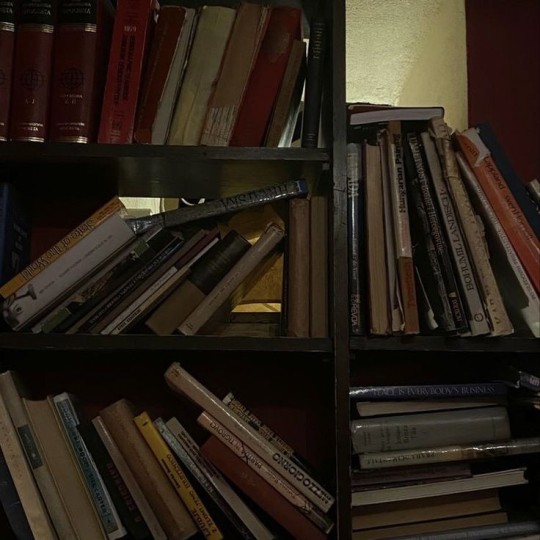
Where is `spaces between books`? This screenshot has height=540, width=540. spaces between books is located at coordinates (291, 132), (151, 202), (268, 306), (425, 81).